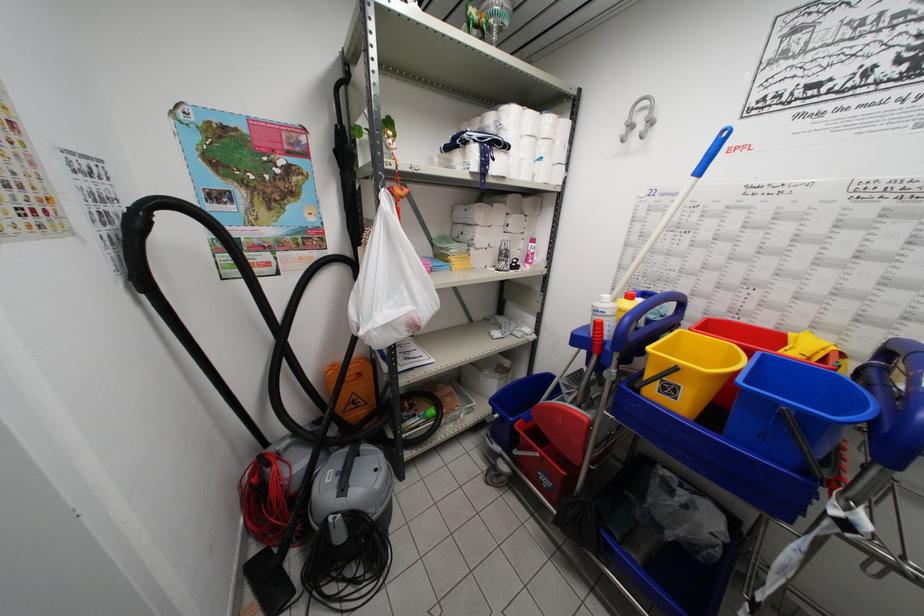
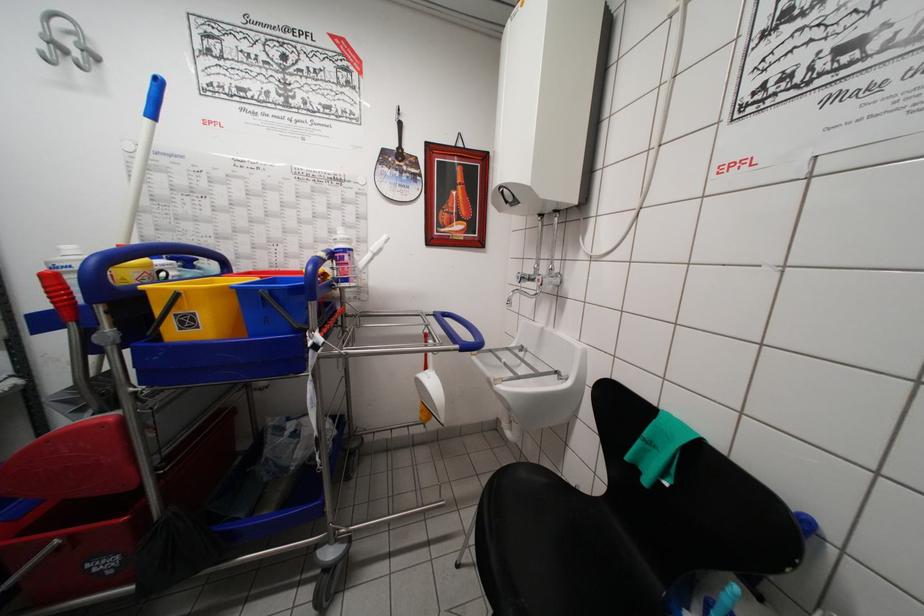
The point at (831, 306) is marked in the first image. Where is the corresponding point in the second image?

(319, 252)